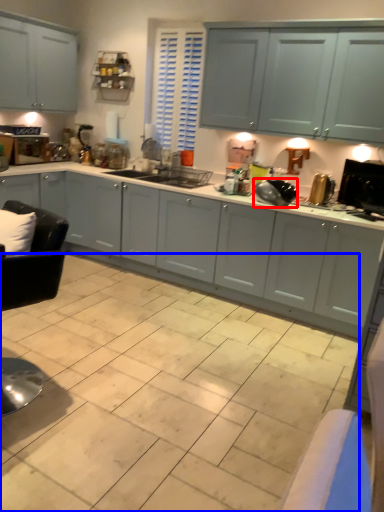
Question: Which object appears closest to the camera in this image, appliance (highlighted by a red box) or ceramic tile (highlighted by a blue box)?

Choices:
 (A) appliance
 (B) ceramic tile

Answer: (B)